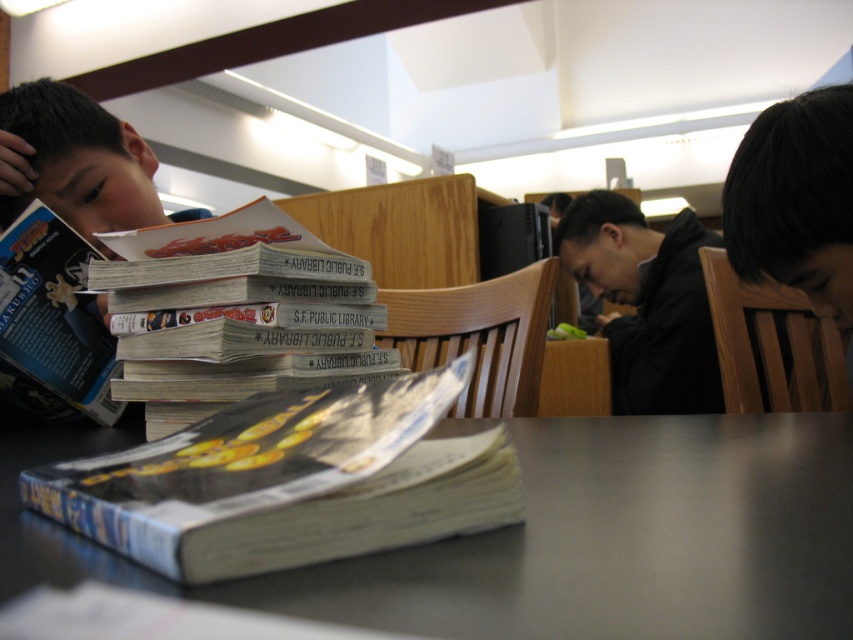
Question: Can you confirm if white glossy book at center is bigger than black matte jacket at center?

Choices:
 (A) yes
 (B) no

Answer: (B)

Question: Which of the following is the farthest from the observer?

Choices:
 (A) smooth gray table at lower center
 (B) black matte jacket at center

Answer: (B)

Question: Which point is closer to the camera?

Choices:
 (A) (65, 540)
 (B) (120, 394)

Answer: (A)

Question: Is smooth gray table at lower center below black matte jacket at center?

Choices:
 (A) yes
 (B) no

Answer: (A)

Question: Considering the relative positions of smooth gray table at lower center and white glossy book at center in the image provided, where is smooth gray table at lower center located with respect to white glossy book at center?

Choices:
 (A) left
 (B) right

Answer: (B)

Question: Which object is closer to the camera taking this photo?

Choices:
 (A) smooth gray table at lower center
 (B) matte black book at left

Answer: (A)